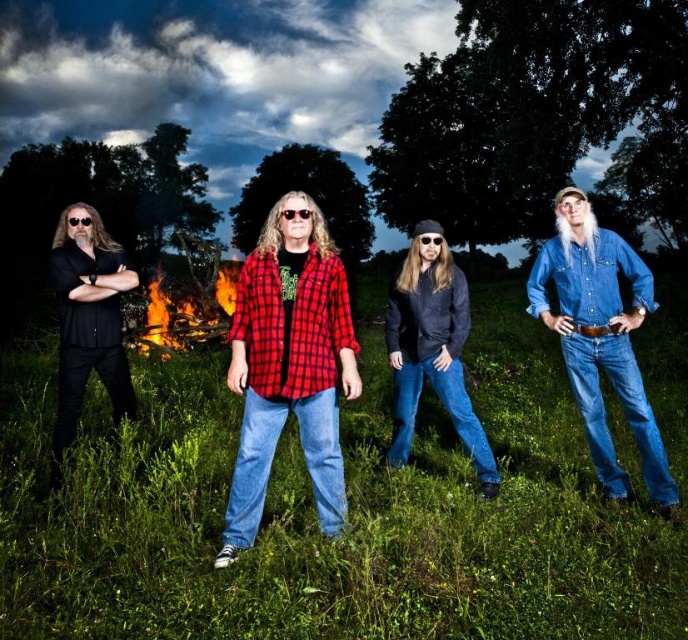
Is point (330, 460) positioned after point (204, 344)?

That is False.

How much distance is there between red plaid flannel shirt at center and flaming wood at center?

red plaid flannel shirt at center and flaming wood at center are 34.68 feet apart from each other.

Is point (327, 452) farther from camera compared to point (149, 316)?

No, it is in front of (149, 316).

Find the location of a particular element. The image size is (688, 640). red plaid flannel shirt at center is located at coordinates (290, 365).

Between green grass at center and flaming wood at center, which one appears on the right side from the viewer's perspective?

Positioned to the right is green grass at center.

Who is more forward, (63, 624) or (171, 342)?

Point (63, 624) is in front.

You are a GUI agent. You are given a task and a screenshot of the screen. Output one action in this format:
    pyautogui.click(x=<x>, y=<y>)
    Task: Click on the green grass at center
    
    Given the screenshot: What is the action you would take?
    coord(314,513)

Does red plaid flannel shirt at center appear on the left side of black matte shirt at left?

Incorrect, red plaid flannel shirt at center is not on the left side of black matte shirt at left.

Who is higher up, red plaid flannel shirt at center or black matte shirt at left?

red plaid flannel shirt at center is higher up.

What do you see at coordinates (290, 365) in the screenshot? I see `red plaid flannel shirt at center` at bounding box center [290, 365].

Find the location of a particular element. Image resolution: width=688 pixels, height=640 pixels. red plaid flannel shirt at center is located at coordinates (290, 365).